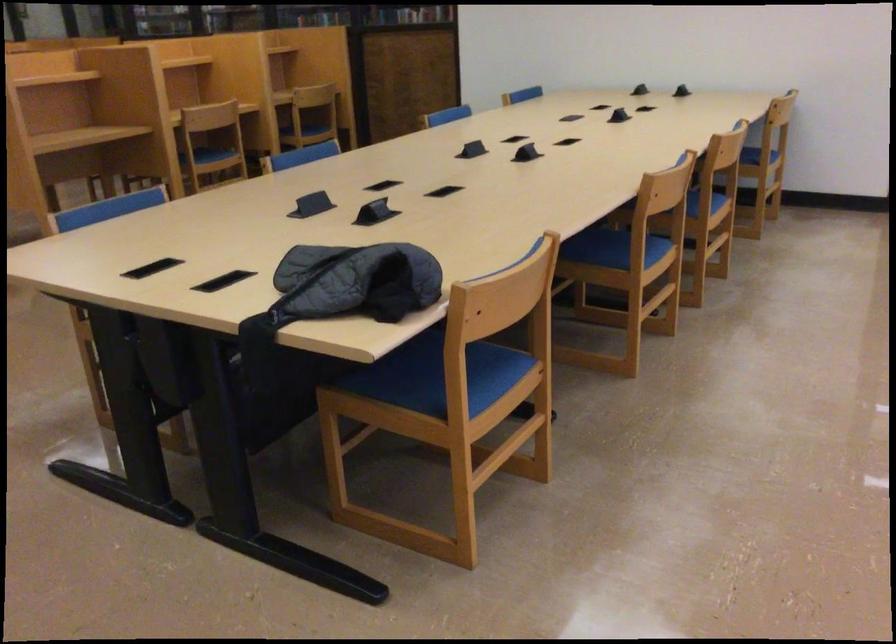
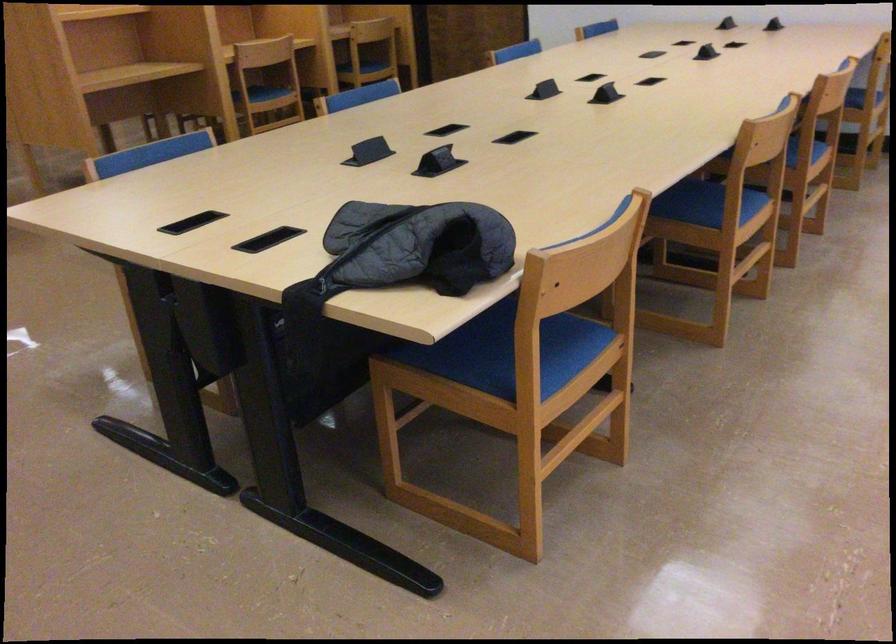
Find the pixel in the second image that matches point (609, 249) in the first image.

(702, 204)